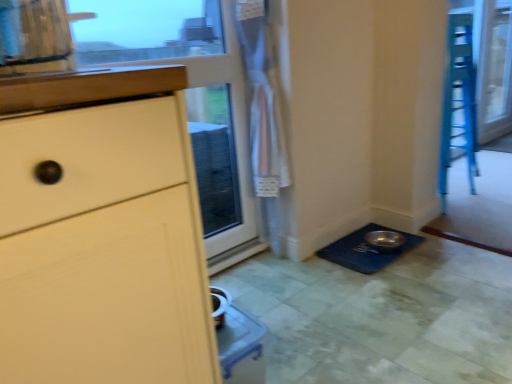
Measure the distance between point (219, 107) and camera.

1.89 meters.

This screenshot has height=384, width=512. What are the coordinates of `transparent glass screen door at upper left` in the screenshot? It's located at (190, 101).

What do you see at coordinates (190, 101) in the screenshot? I see `transparent glass screen door at upper left` at bounding box center [190, 101].

Find the location of a particular element. This screenshot has height=384, width=512. transparent glass screen door at upper left is located at coordinates (190, 101).